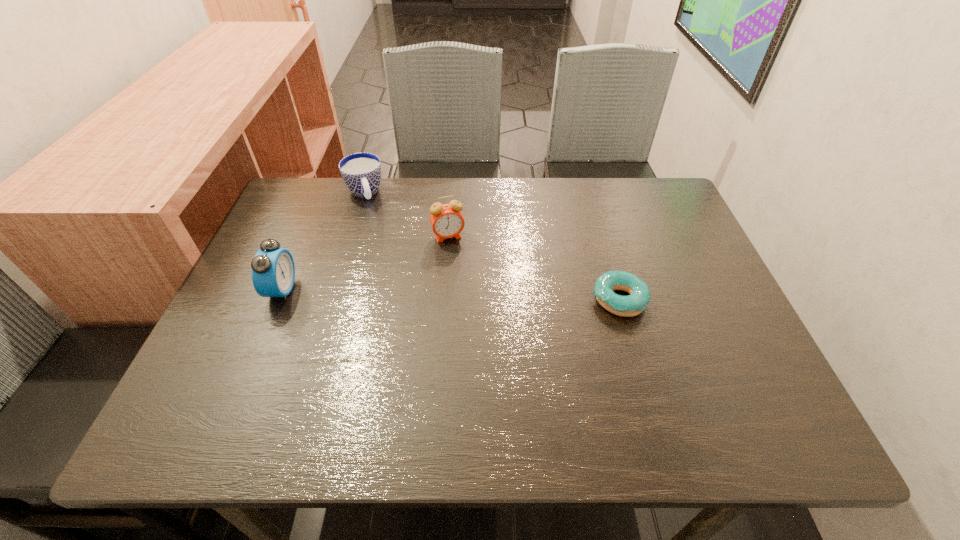
You are a GUI agent. You are given a task and a screenshot of the screen. Output one action in this format:
    pyautogui.click(x=<x>, y=<y>)
    Task: Click on the free space on the desktop that is between the left alarm clock and the doughnut and is positioned on the face of the second object from right to left
    
    Given the screenshot: What is the action you would take?
    [x=468, y=295]

Find the location of a particular element. The height and width of the screenshot is (540, 960). free spot on the desktop that is between the nearer alarm clock and the doughnut and is positioned on the side of the farthest object with the handle is located at coordinates (399, 293).